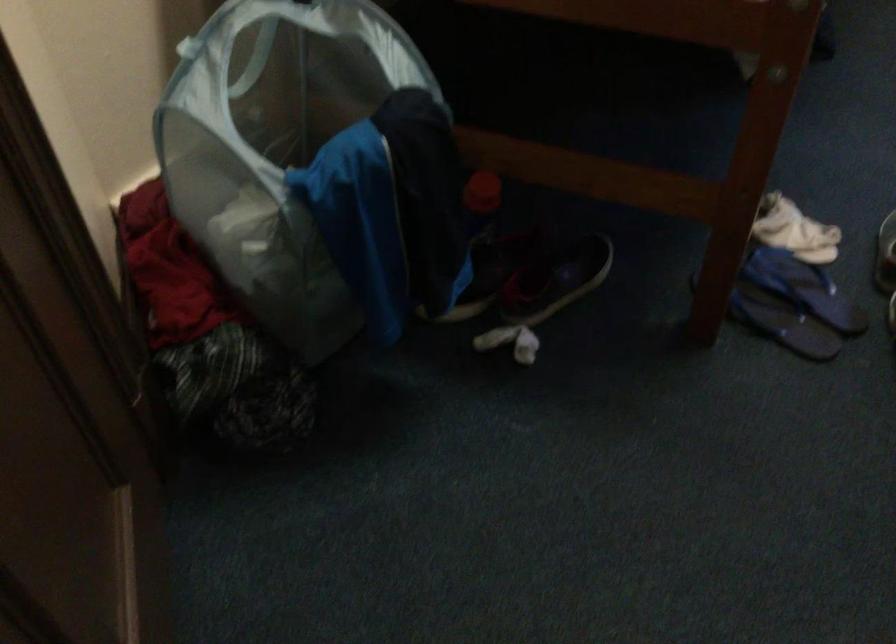
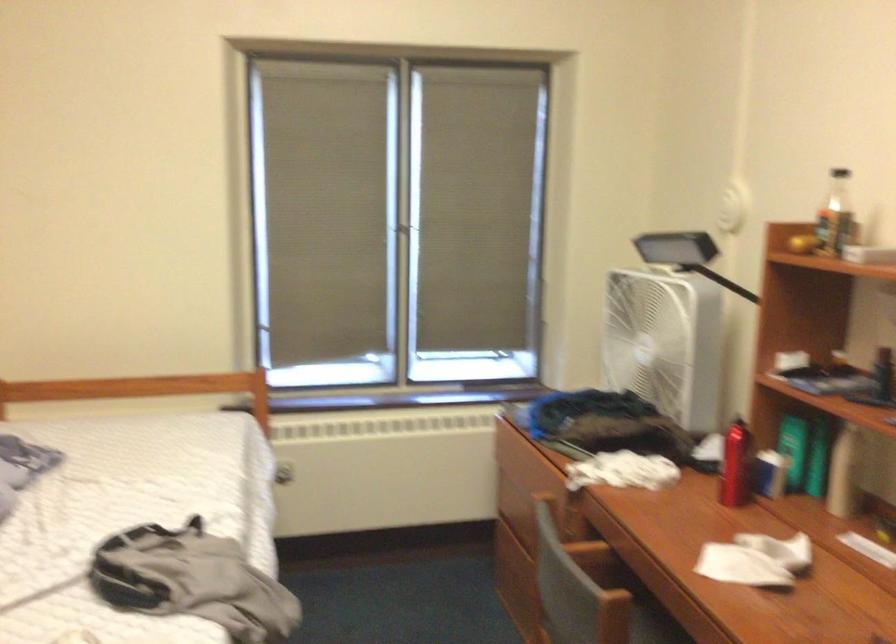
How did the camera likely rotate?

The camera rotated toward right-up.